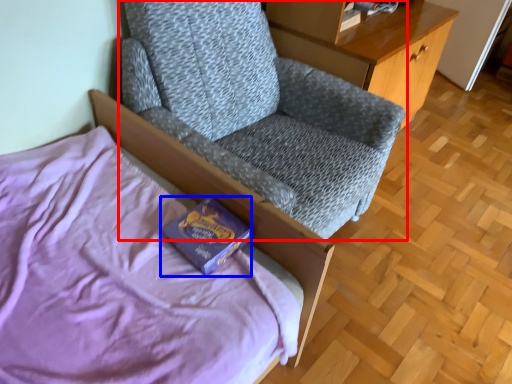
Question: Which of the following is the closest to the observer, chair (highlighted by a red box) or paperback book (highlighted by a blue box)?

Choices:
 (A) chair
 (B) paperback book

Answer: (A)